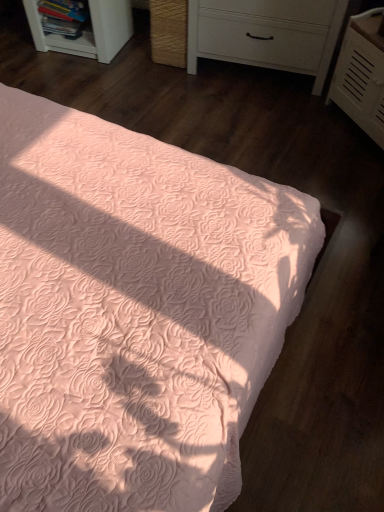
Question: Is white textured chest of drawers at upper right, the 2th chest of drawers in the left-to-right sequence, in front of or behind white plastic shelf at upper left in the image?

Choices:
 (A) front
 (B) behind

Answer: (A)

Question: Is white textured chest of drawers at upper right, the 2th chest of drawers in the left-to-right sequence, spatially inside white plastic shelf at upper left, or outside of it?

Choices:
 (A) outside
 (B) inside

Answer: (A)

Question: Which object is the closest to the peach quilted bed at center?

Choices:
 (A) white matte chest of drawers at upper center, which ranks as the first chest of drawers in left-to-right order
 (B) white plastic shelf at upper left
 (C) white textured chest of drawers at upper right, which ranks as the 1th chest of drawers in right-to-left order

Answer: (C)

Question: Estimate the real-world distances between objects in this image. Which object is farther from the white textured chest of drawers at upper right, the 2th chest of drawers in the left-to-right sequence?

Choices:
 (A) peach quilted bed at center
 (B) white matte chest of drawers at upper center, which ranks as the first chest of drawers in left-to-right order
 (C) white plastic shelf at upper left

Answer: (C)